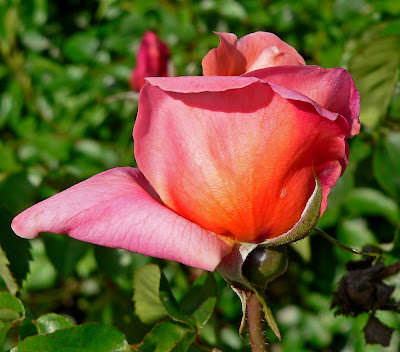
The width and height of the screenshot is (400, 352). I want to click on light on bulb, so click(261, 256).